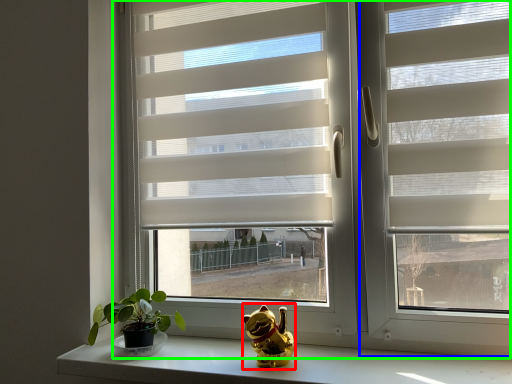
Question: Which is nearer to the figurine (highlighted by a red box)? screen door (highlighted by a blue box) or window (highlighted by a green box).

Choices:
 (A) screen door
 (B) window

Answer: (A)